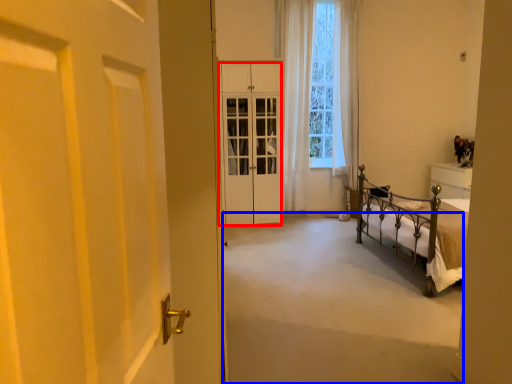
Question: Which of the following is the farthest to the observer, cabinetry (highlighted by a red box) or corridor (highlighted by a blue box)?

Choices:
 (A) cabinetry
 (B) corridor

Answer: (A)